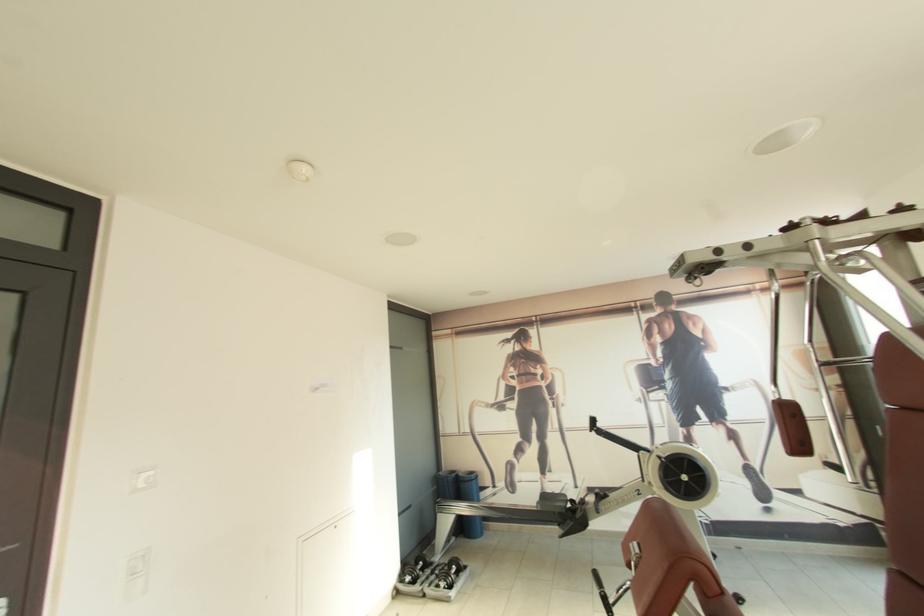
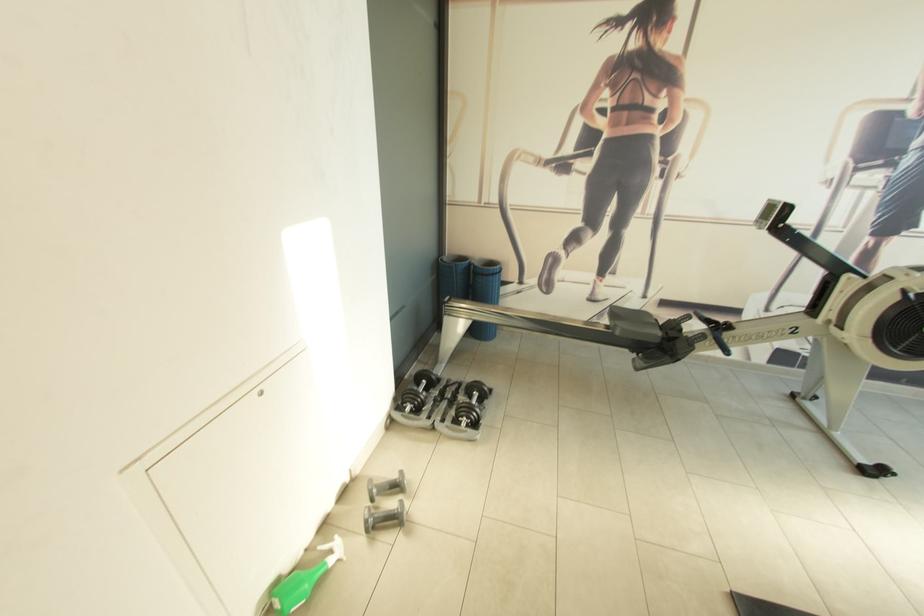
Locate, in the second image, the point that corresponds to (x=448, y=582) in the first image.

(472, 419)